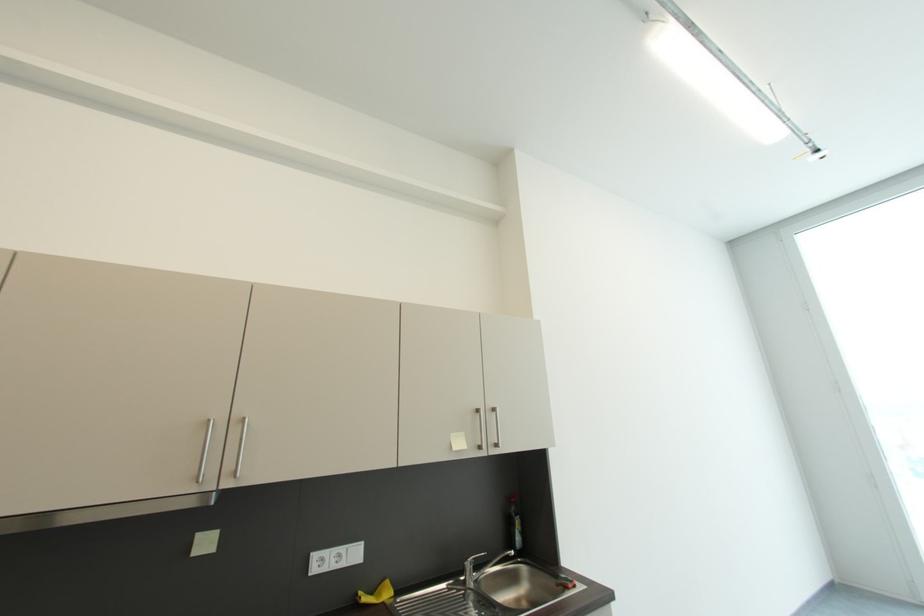
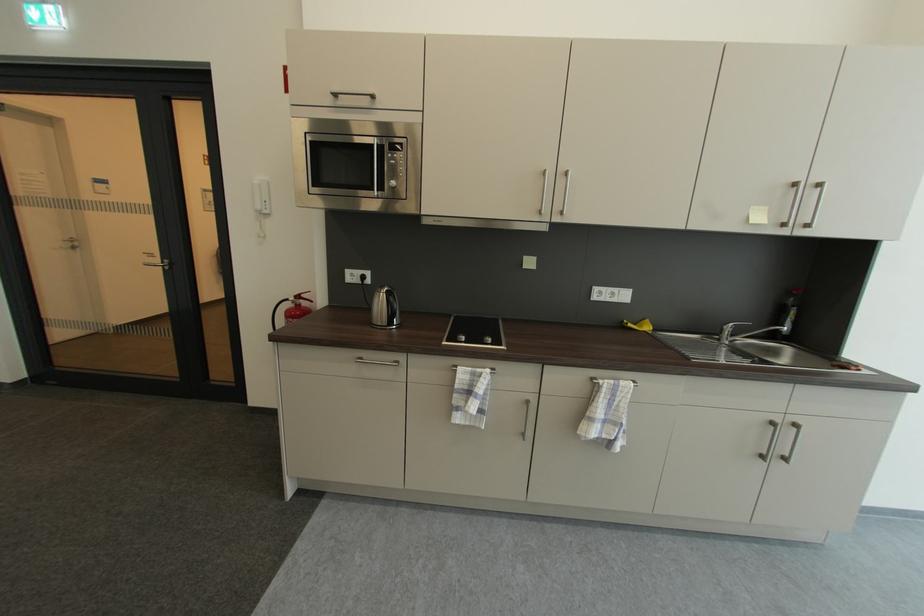
The point at (468, 580) is marked in the first image. Where is the corresponding point in the second image?

(723, 339)